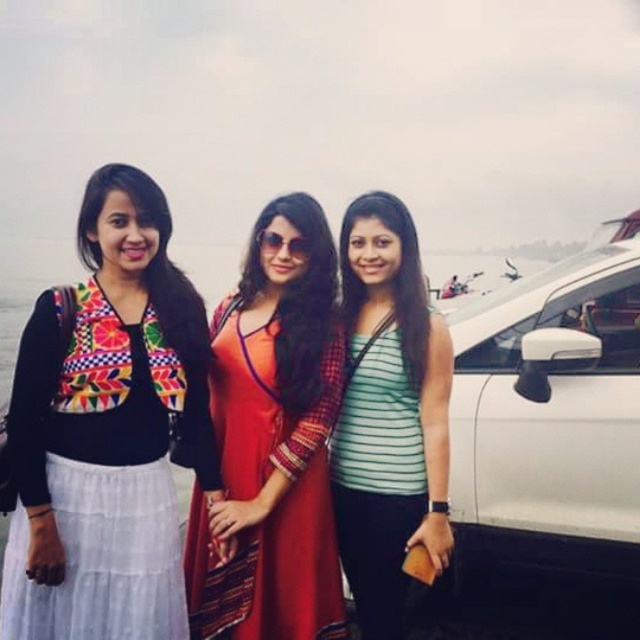
Looking at this image, does green striped tank top at center appear on the left side of black cotton dress at left?

Incorrect, green striped tank top at center is not on the left side of black cotton dress at left.

Which is above, green striped tank top at center or black cotton dress at left?

green striped tank top at center is higher up.

What are the coordinates of `green striped tank top at center` in the screenshot? It's located at (388, 413).

You are a GUI agent. You are given a task and a screenshot of the screen. Output one action in this format:
    pyautogui.click(x=<x>, y=<y>)
    Task: Click on the green striped tank top at center
    The width and height of the screenshot is (640, 640).
    Given the screenshot: What is the action you would take?
    pyautogui.click(x=388, y=413)

Is white glossy car at right positioned at the back of green striped tank top at center?

Yes, white glossy car at right is further from the viewer.

Does point (508, 333) come in front of point (381, 365)?

No.

Where is `white glossy car at right`? The width and height of the screenshot is (640, 640). white glossy car at right is located at coordinates (552, 436).

Is point (234, 470) positioned after point (170, 508)?

Yes, point (234, 470) is behind point (170, 508).

Can you confirm if matte red dress at center is positioned to the right of black cotton dress at left?

Result: Yes, matte red dress at center is to the right of black cotton dress at left.

Is point (225, 634) more distant than point (22, 573)?

That is True.

The width and height of the screenshot is (640, 640). In order to click on matte red dress at center in this screenshot , I will do `click(257, 497)`.